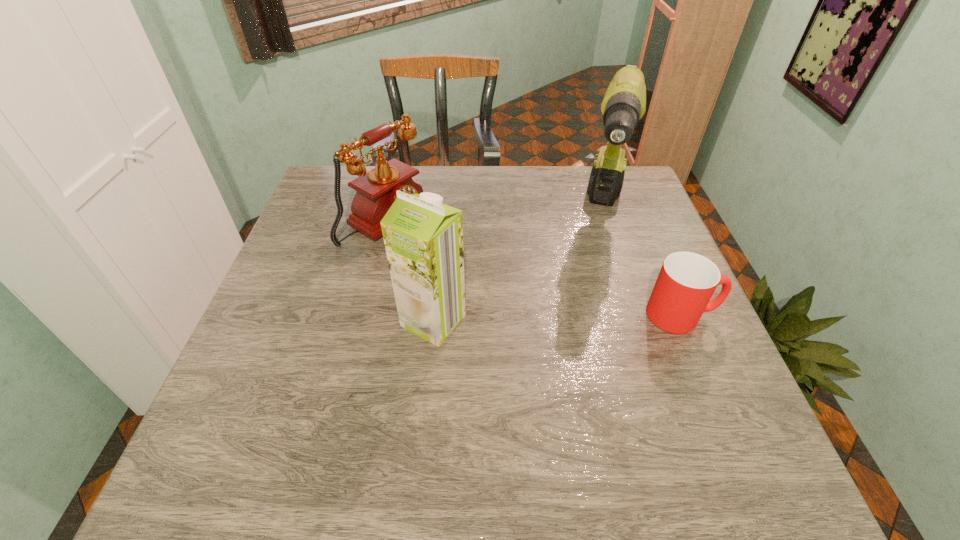
Choose which object is the third nearest neighbor to the cup. Please provide its 2D coordinates. Your answer should be formatted as a tuple, i.e. [(x, y)], where the tuple contains the x and y coordinates of a point satisfying the conditions above.

[(376, 190)]

The height and width of the screenshot is (540, 960). I want to click on vacant position in the image that satisfies the following two spatial constraints: 1. on the back side of the shortest object; 2. on the side of the soya milk with the handle, so click(x=434, y=315).

Where is `vacant space that satisfies the following two spatial constraints: 1. on the front side of the shortest object; 2. on the side of the drill with the handle`? This screenshot has height=540, width=960. vacant space that satisfies the following two spatial constraints: 1. on the front side of the shortest object; 2. on the side of the drill with the handle is located at coordinates (637, 315).

The width and height of the screenshot is (960, 540). Find the location of `vacant position in the image that satisfies the following two spatial constraints: 1. on the front side of the drill; 2. on the side of the shortest object with the handle`. vacant position in the image that satisfies the following two spatial constraints: 1. on the front side of the drill; 2. on the side of the shortest object with the handle is located at coordinates (637, 315).

This screenshot has height=540, width=960. I want to click on free space that satisfies the following two spatial constraints: 1. on the front side of the shortest object; 2. on the side of the telephone with the handle, so click(x=364, y=315).

This screenshot has height=540, width=960. I want to click on vacant space that satisfies the following two spatial constraints: 1. on the front side of the soya milk; 2. on the left side of the telephone, so pos(362,320).

What are the coordinates of `free spot that satisfies the following two spatial constraints: 1. on the back side of the shortest object; 2. on the side of the soya milk with the handle` in the screenshot? It's located at (434, 315).